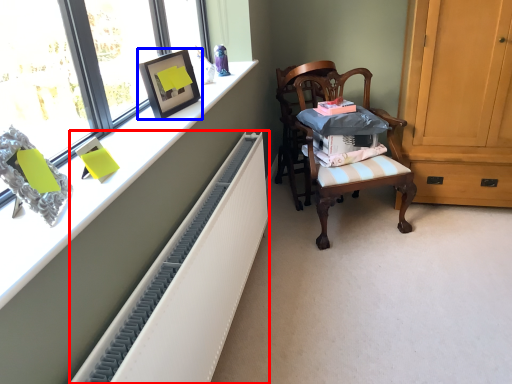
Question: Which object is further to the camera taking this photo, radiator (highlighted by a red box) or picture frame (highlighted by a blue box)?

Choices:
 (A) radiator
 (B) picture frame

Answer: (B)